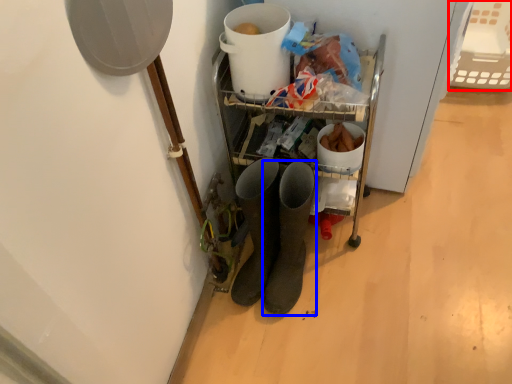
Question: Which point is closer to the camera, basket (highlighted by a red box) or footwear (highlighted by a blue box)?

Choices:
 (A) basket
 (B) footwear

Answer: (B)